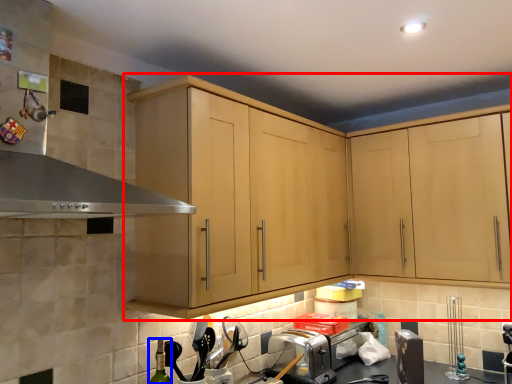
Question: Which object appears closest to the camera in this image, cabinetry (highlighted by a red box) or bottle (highlighted by a blue box)?

Choices:
 (A) cabinetry
 (B) bottle

Answer: (A)